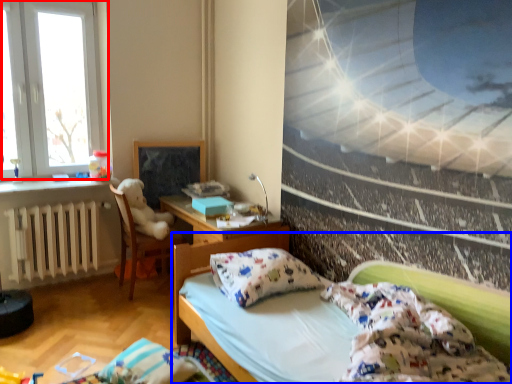
Question: Which point is closer to the camera, window (highlighted by a red box) or bed (highlighted by a blue box)?

Choices:
 (A) window
 (B) bed

Answer: (B)